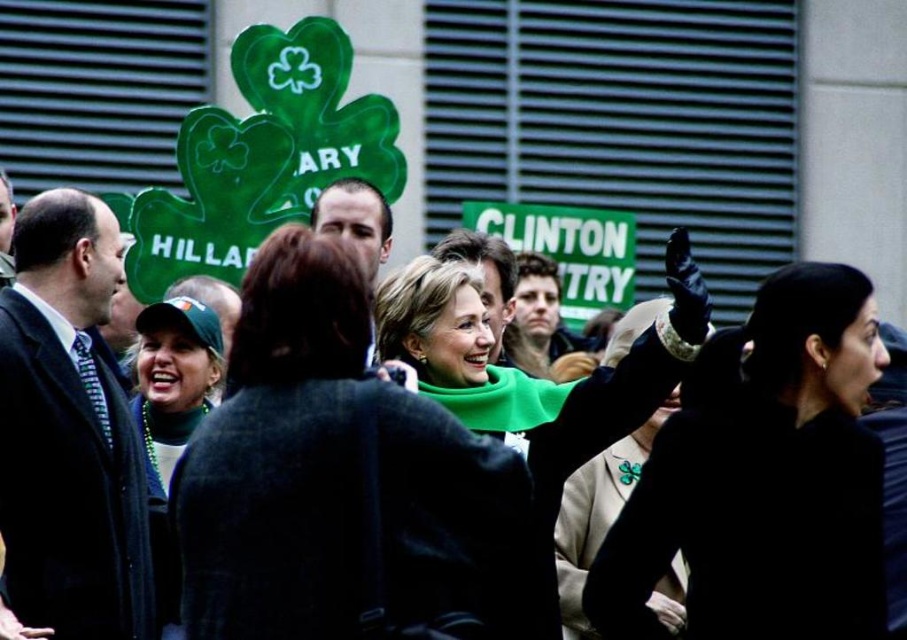
Question: Can you confirm if dark blue suit at left is positioned above dark brown hair at center?

Choices:
 (A) no
 (B) yes

Answer: (A)

Question: Is black satin dress at right wider than green wool scarf at center?

Choices:
 (A) no
 (B) yes

Answer: (A)

Question: Estimate the real-world distances between objects in this image. Which object is farther from the black satin dress at right?

Choices:
 (A) dark brown hair at center
 (B) smooth brown leather jacket at center

Answer: (B)

Question: Can you confirm if green fabric baseball cap at left is positioned above smooth brown hair at center?

Choices:
 (A) yes
 (B) no

Answer: (B)

Question: Which of these objects is positioned farthest from the green wool scarf at center?

Choices:
 (A) smooth brown hair at center
 (B) green matte scarf at center

Answer: (B)

Question: Which point appears closest to the camera in this image?

Choices:
 (A) (74, 589)
 (B) (582, 410)
 (C) (540, 312)

Answer: (A)